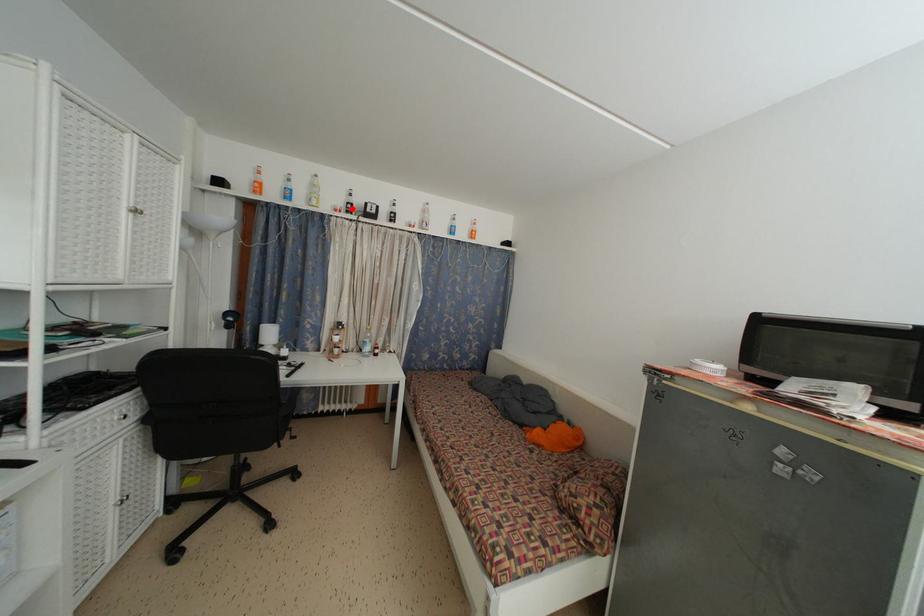
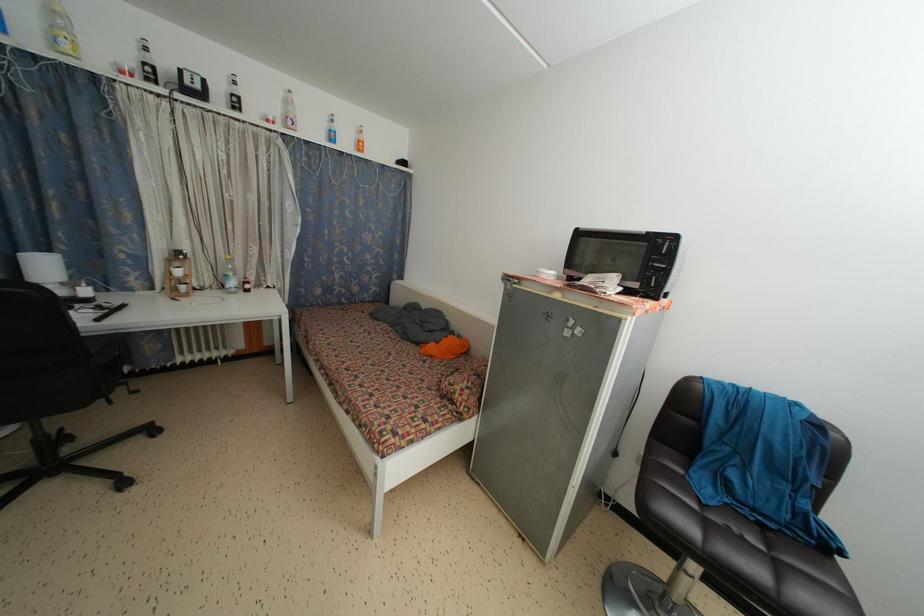
Question: I am providing you with two images of the same scene from different viewpoints. Given a red point in image1, look at the same physical point in image2. Is it:

Choices:
 (A) Closer to the viewpoint
 (B) Farther from the viewpoint

Answer: (B)